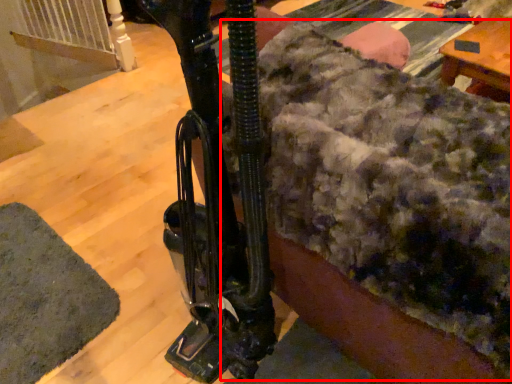
Question: Observing the image, what is the correct spatial positioning of blanket (annotated by the red box) in reference to mat?

Choices:
 (A) right
 (B) left

Answer: (A)